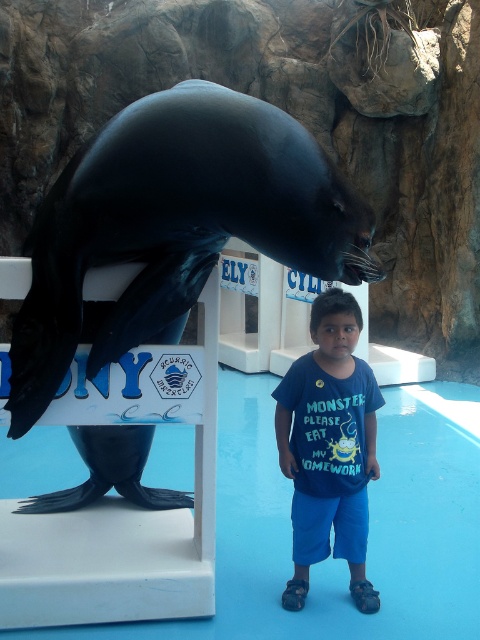
Question: Which of the following is the farthest from the observer?

Choices:
 (A) blue cotton shirt at center
 (B) shiny black seal at center

Answer: (A)

Question: Can you confirm if shiny black seal at center is bigger than blue cotton shirt at center?

Choices:
 (A) yes
 (B) no

Answer: (A)

Question: Is shiny black seal at center further to camera compared to blue cotton shirt at center?

Choices:
 (A) no
 (B) yes

Answer: (A)

Question: Is shiny black seal at center to the right of blue cotton shirt at center from the viewer's perspective?

Choices:
 (A) yes
 (B) no

Answer: (B)